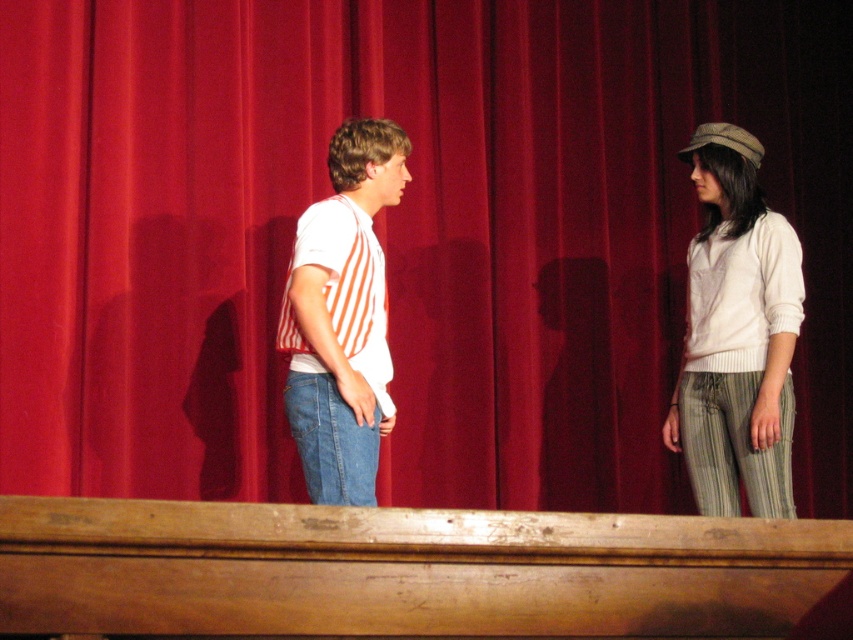
You are a photographer setting up for a stage performance. You need to ensure that both the white knit sweater at right and the white striped shirt at center are clearly visible in your shot. Given their height difference, which clothing item might require you to adjust your camera angle to avoid being obscured by the backdrop?

The white knit sweater at right is much taller than the white striped shirt at center, so adjusting the camera angle might be necessary to prevent the white knit sweater at right from being obscured by the rich red curtain backdrop.

You are designing a stage layout for a play and need to place a spotlight at coordinates where the white knit sweater at right will be centered. What are the coordinates for the spotlight?

The coordinates for the spotlight should be set at point (735, 333) to center the white knit sweater at right.